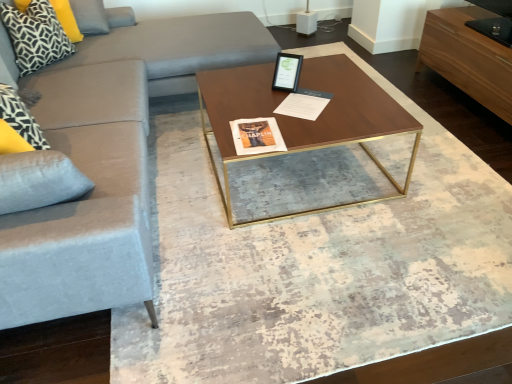
Where is `vacant area on the back side of white paper at center`? This screenshot has width=512, height=384. vacant area on the back side of white paper at center is located at coordinates (302, 79).